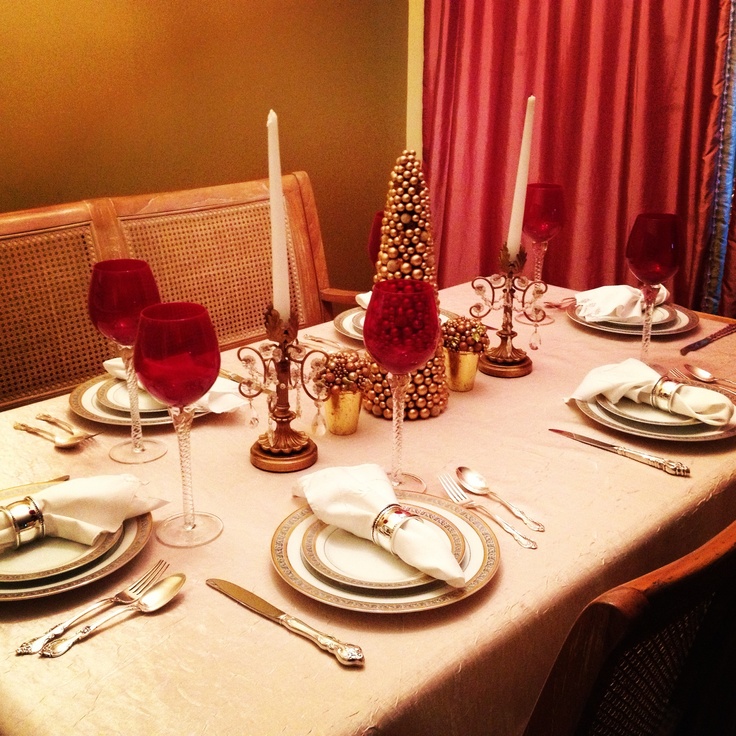
Locate an element on the screen. The image size is (736, 736). spoons is located at coordinates (477, 480), (693, 368), (552, 296), (68, 444), (162, 590).